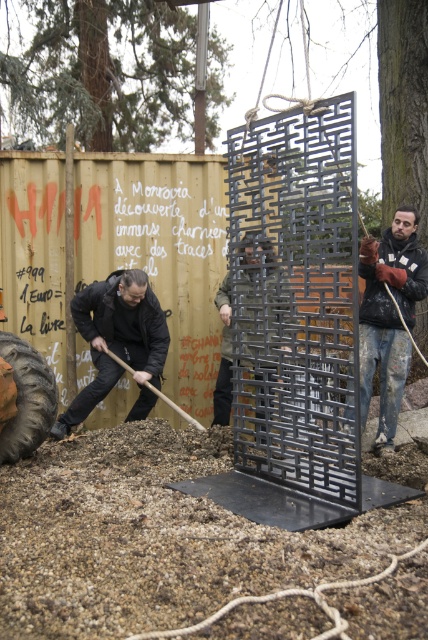
Is painted denim jacket at right shorter than metallic grid at center?

No, painted denim jacket at right is not shorter than metallic grid at center.

Between painted denim jacket at right and metallic grid at center, which one has less height?

Standing shorter between the two is metallic grid at center.

Is point (398, 230) farther from viewer compared to point (273, 260)?

Yes, point (398, 230) is behind point (273, 260).

Find the location of a particular element. painted denim jacket at right is located at coordinates (389, 316).

Does point (228, 344) come in front of point (38, 410)?

No, (228, 344) is further to viewer.

Is metallic grid at center positioned behind dark gray rubber tire at lower left?

That is False.

What are the coordinates of `metallic grid at center` in the screenshot? It's located at (252, 316).

Is the position of metallic grid at center less distant than that of smooth wooden shovel at lower center?

Yes, metallic grid at center is closer to the viewer.

Who is lower down, metallic grid at center or smooth wooden shovel at lower center?

Positioned lower is smooth wooden shovel at lower center.

Looking at this image, who is more forward, (264, 349) or (109, 349)?

Point (264, 349) is in front.

Image resolution: width=428 pixels, height=640 pixels. In order to click on metallic grid at center in this screenshot , I will do `click(252, 316)`.